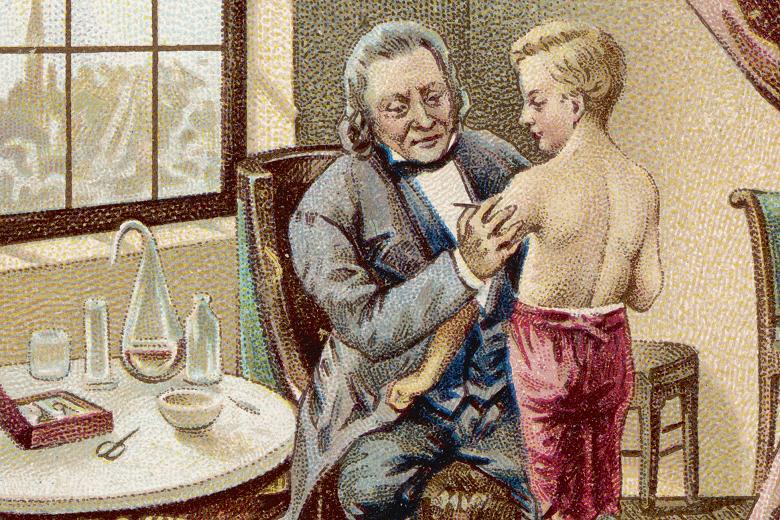
Locate an element on the screen. The image size is (780, 520). window is located at coordinates (108, 101).